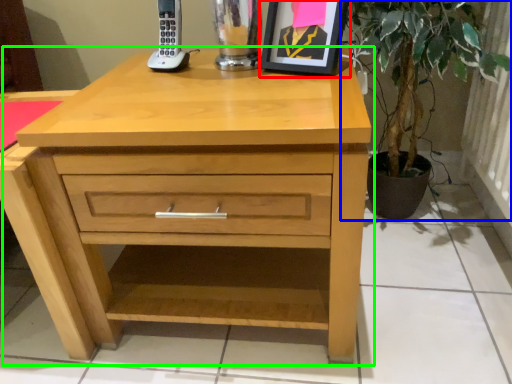
Question: Estimate the real-world distances between objects in this image. Which object is closer to picture frame (highlighted by a red box), houseplant (highlighted by a blue box) or chest of drawers (highlighted by a green box)?

Choices:
 (A) houseplant
 (B) chest of drawers

Answer: (A)